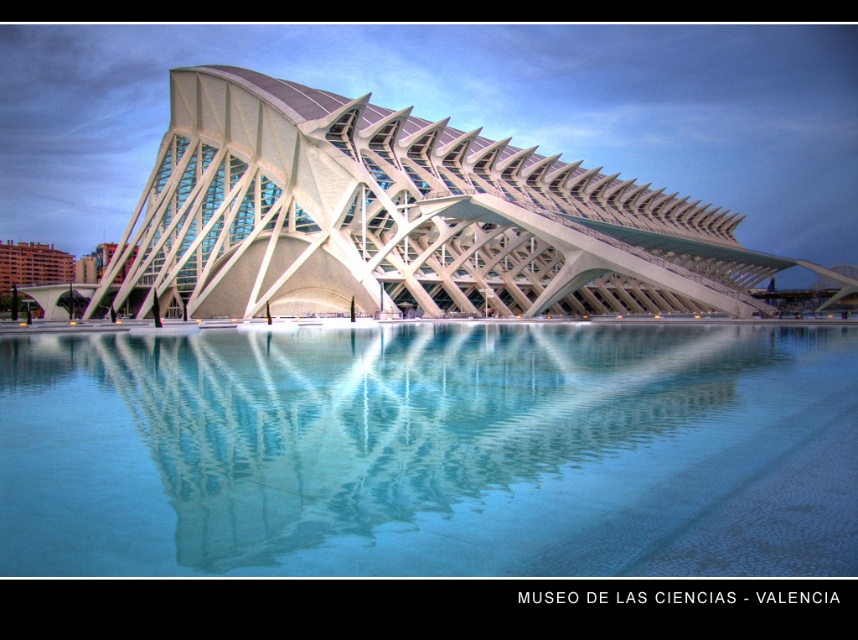
Is clear glass water at center taller than white glass building at center?

No.

Between clear glass water at center and white glass building at center, which one has less height?

clear glass water at center

Which is behind, point (569, 531) or point (551, 236)?

The point (551, 236) is more distant.

Find the location of a particular element. This screenshot has height=640, width=858. clear glass water at center is located at coordinates (431, 451).